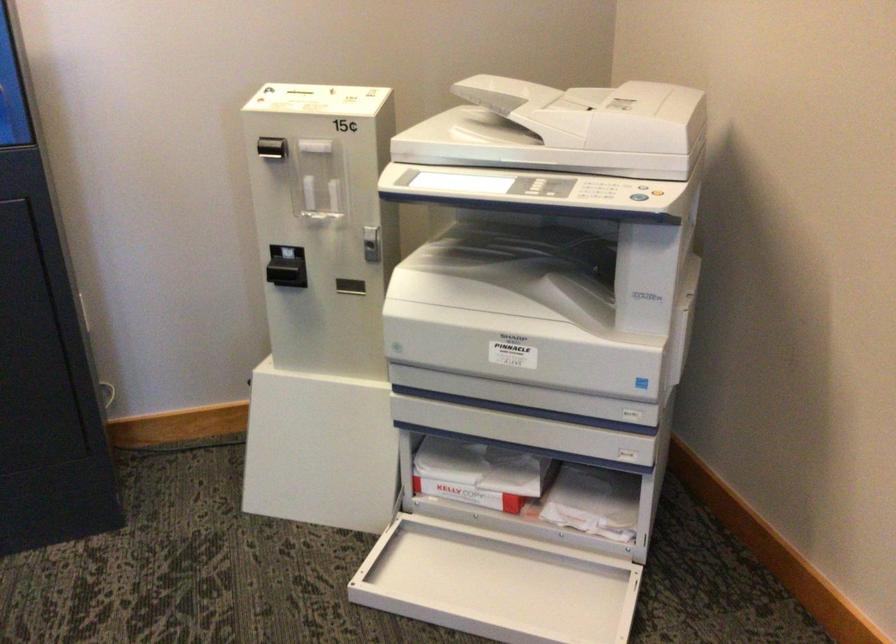
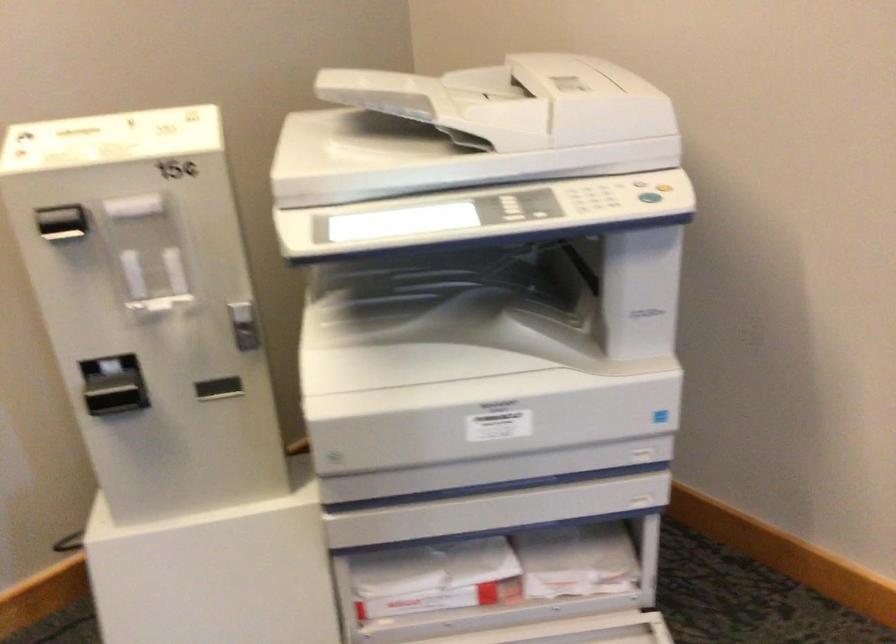
Question: The images are taken continuously from a first-person perspective. In which direction is your viewpoint rotating?

Choices:
 (A) Left
 (B) Right
 (C) Up
 (D) Down

Answer: (B)